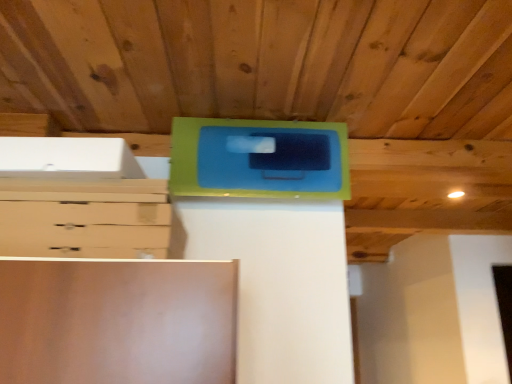
Question: Does green matte cabinet at upper center have a larger size compared to matte light brown chest of drawers at left?

Choices:
 (A) no
 (B) yes

Answer: (B)

Question: From a real-world perspective, is green matte cabinet at upper center beneath matte light brown chest of drawers at left?

Choices:
 (A) yes
 (B) no

Answer: (B)

Question: Can you confirm if green matte cabinet at upper center is smaller than matte light brown chest of drawers at left?

Choices:
 (A) no
 (B) yes

Answer: (A)

Question: Considering the relative sizes of green matte cabinet at upper center and matte light brown chest of drawers at left in the image provided, is green matte cabinet at upper center shorter than matte light brown chest of drawers at left?

Choices:
 (A) yes
 (B) no

Answer: (B)

Question: Is green matte cabinet at upper center facing towards matte light brown chest of drawers at left?

Choices:
 (A) no
 (B) yes

Answer: (A)

Question: Is green matte cabinet at upper center outside matte light brown chest of drawers at left?

Choices:
 (A) yes
 (B) no

Answer: (A)

Question: Is matte light brown chest of drawers at left not near green matte cabinet at upper center?

Choices:
 (A) no
 (B) yes

Answer: (A)

Question: Is matte light brown chest of drawers at left oriented away from green matte cabinet at upper center?

Choices:
 (A) no
 (B) yes

Answer: (A)

Question: Does matte light brown chest of drawers at left come in front of green matte cabinet at upper center?

Choices:
 (A) no
 (B) yes

Answer: (B)

Question: Is matte light brown chest of drawers at left outside of green matte cabinet at upper center?

Choices:
 (A) no
 (B) yes

Answer: (B)

Question: From the image's perspective, is matte light brown chest of drawers at left under green matte cabinet at upper center?

Choices:
 (A) no
 (B) yes

Answer: (B)

Question: Is matte light brown chest of drawers at left at the left side of green matte cabinet at upper center?

Choices:
 (A) no
 (B) yes

Answer: (B)

Question: Is point (317, 135) positioned closer to the camera than point (82, 208)?

Choices:
 (A) farther
 (B) closer

Answer: (A)